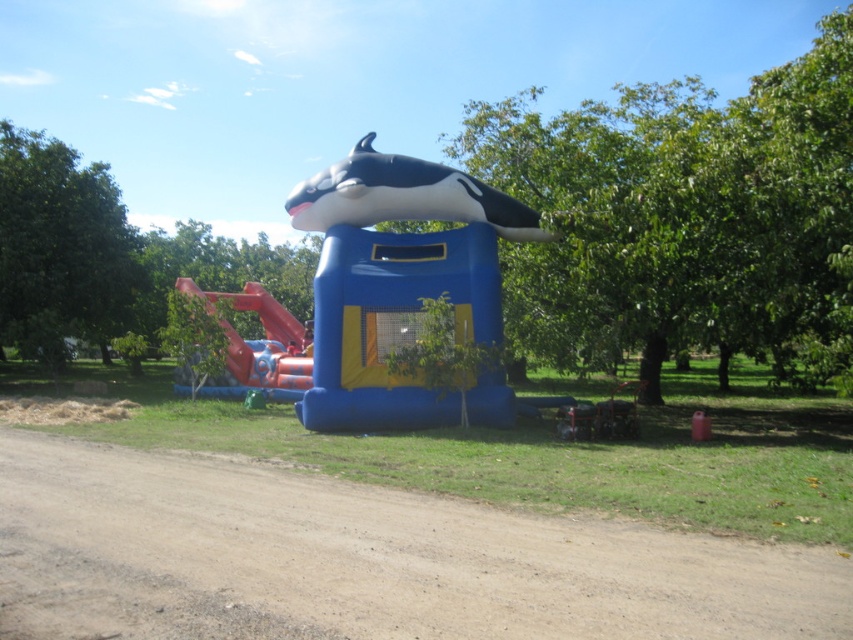
You are standing at the entrance of the bouncy castle and want to locate the black matte whale at center. According to the coordinates provided, where should you look relative to the center of the image?

The black matte whale at center is located at coordinates point 0.308 on the x axis and 0.475 on the y axis, which is slightly to the left and below the center of the image.